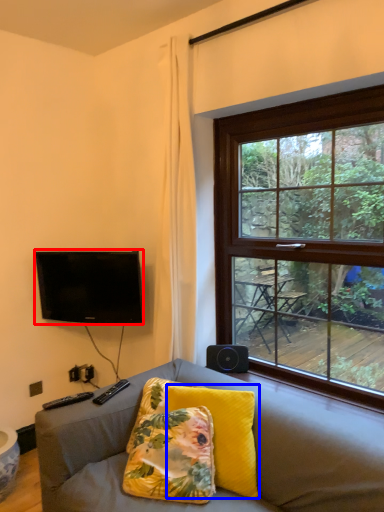
Question: Which point is further to the camera, television (highlighted by a red box) or pillow (highlighted by a blue box)?

Choices:
 (A) television
 (B) pillow

Answer: (A)